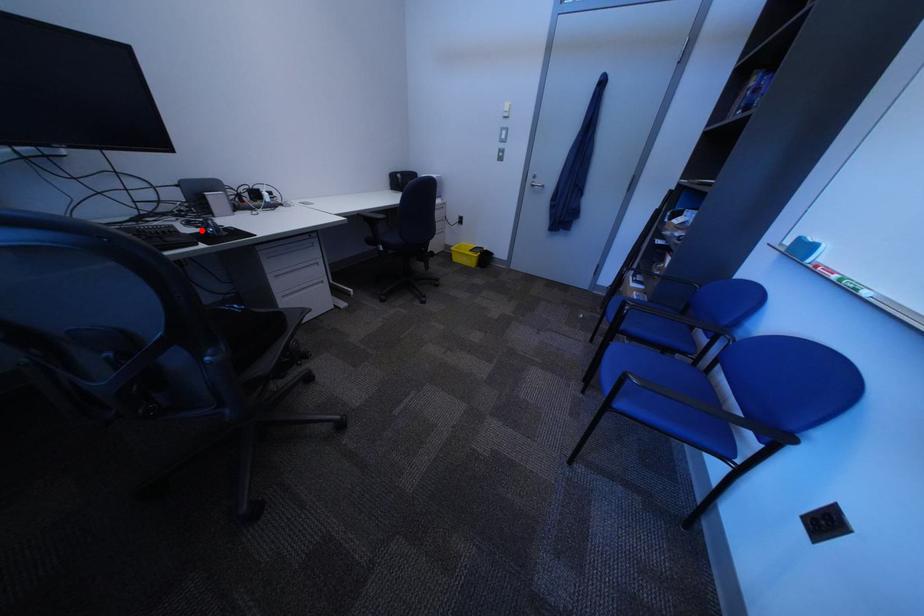
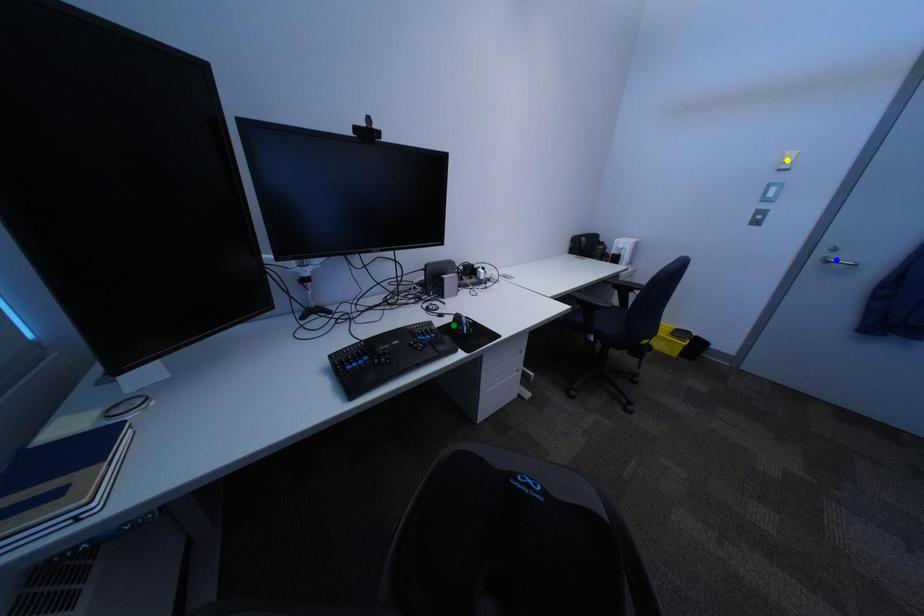
Question: I am providing you with two images of the same scene from different viewpoints. A red point is marked on the first image. You are given multiple points on the second image. Which point in image 2 is actually the same real-world point as the red point in image 1?

Choices:
 (A) yellow point
 (B) blue point
 (C) green point

Answer: (C)